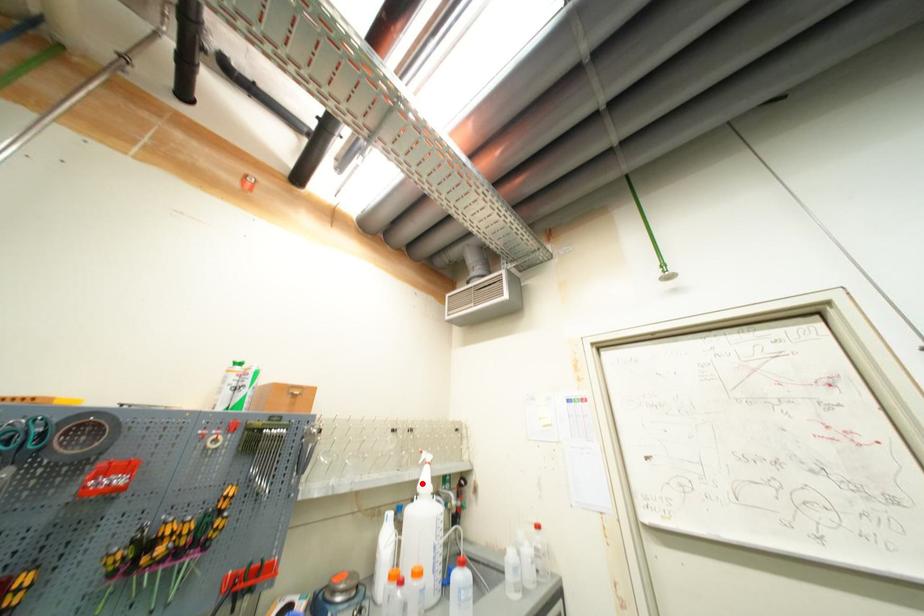
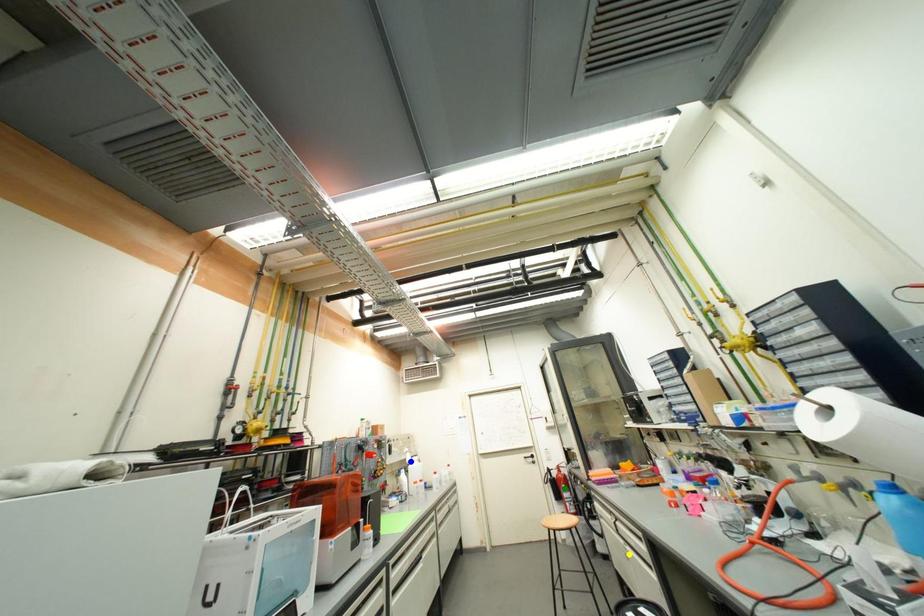
Question: I am providing you with two images of the same scene from different viewpoints. A red point is marked on the first image. You are given multiple points on the second image. Which point in image 2 is actually the same real-world point as the red point in image 1?

Choices:
 (A) blue point
 (B) yellow point
 (C) green point

Answer: (A)